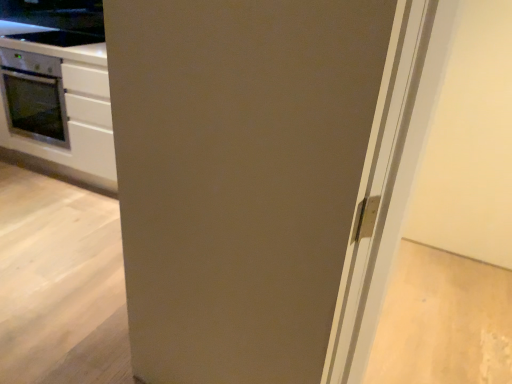
Question: Considering their positions, is matte gray door at center located in front of or behind smooth black countertop at upper left?

Choices:
 (A) front
 (B) behind

Answer: (A)

Question: Is matte gray door at center situated inside smooth black countertop at upper left or outside?

Choices:
 (A) inside
 (B) outside

Answer: (B)

Question: Which object is positioned farthest from the white glossy cabinet at left?

Choices:
 (A) matte gray door at center
 (B) smooth black countertop at upper left

Answer: (A)

Question: Which object is the closest to the matte gray door at center?

Choices:
 (A) smooth black countertop at upper left
 (B) white glossy cabinet at left

Answer: (B)